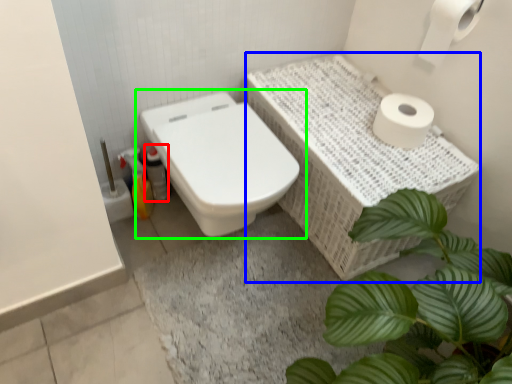
Question: Which object is positioned closest to bottle (highlighted by a red box)? Select from counter top (highlighted by a blue box) and toilet (highlighted by a green box).

Choices:
 (A) counter top
 (B) toilet

Answer: (B)